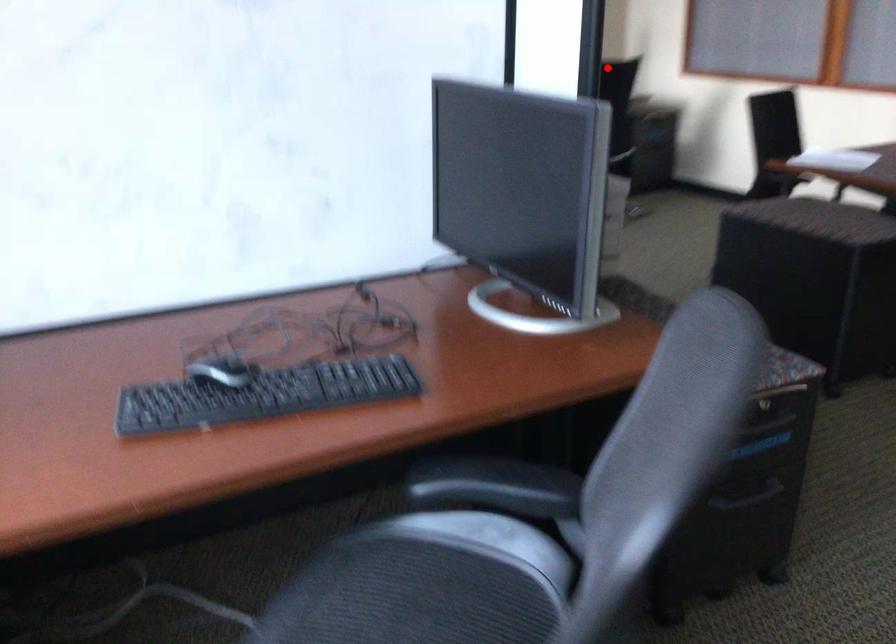
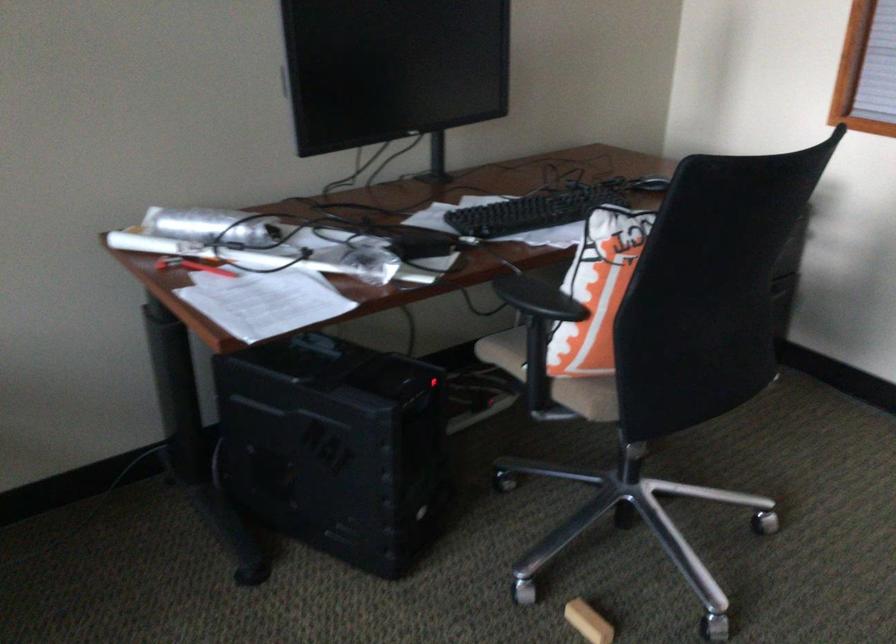
Question: I am providing you with two images of the same scene from different viewpoints. Image1 has a red point marked. In image2, the corresponding 3D location appears at what relative position? Reply with the corresponding letter.

Choices:
 (A) Closer
 (B) Farther

Answer: (A)